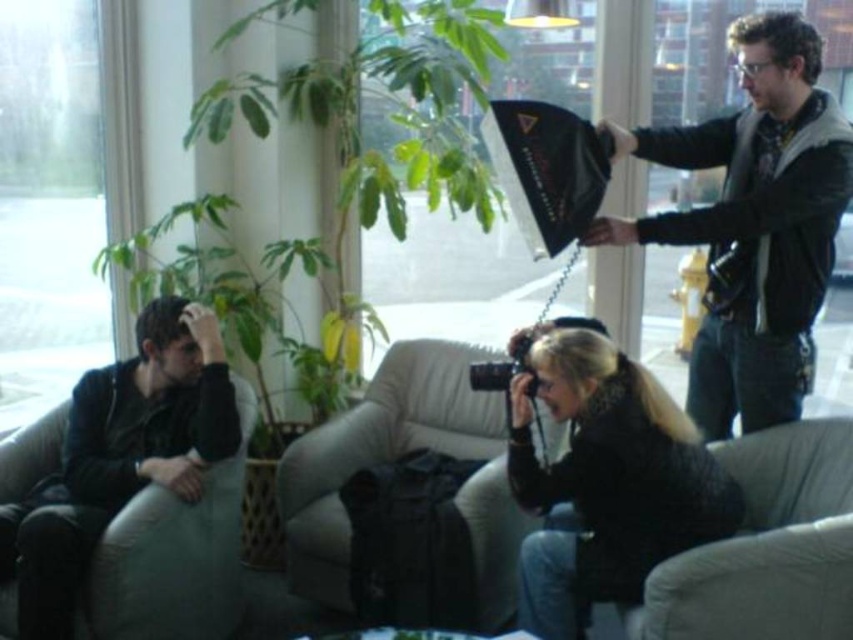
Is green leafy plant at center to the right of beige fabric couch at center from the viewer's perspective?

No, green leafy plant at center is not to the right of beige fabric couch at center.

Between green leafy plant at center and beige fabric couch at center, which one appears on the right side from the viewer's perspective?

From the viewer's perspective, beige fabric couch at center appears more on the right side.

Measure the distance between point (463, 145) and camera.

A distance of 3.37 meters exists between point (463, 145) and camera.

The width and height of the screenshot is (853, 640). What are the coordinates of `green leafy plant at center` in the screenshot? It's located at (337, 180).

Which is below, black leather jacket at left or gray fabric armchair at lower right?

gray fabric armchair at lower right is lower down.

Between point (175, 392) and point (764, 604), which one is positioned behind?

Point (175, 392)

Which is behind, point (41, 616) or point (672, 593)?

Point (41, 616)

This screenshot has height=640, width=853. Identify the location of black leather jacket at left. (120, 456).

Between point (822, 163) and point (160, 368), which one is positioned behind?

The point (160, 368) is behind.

Is black leather jacket at upper right wider than black leather jacket at left?

Correct, the width of black leather jacket at upper right exceeds that of black leather jacket at left.

Describe the element at coordinates (753, 225) in the screenshot. The image size is (853, 640). I see `black leather jacket at upper right` at that location.

This screenshot has width=853, height=640. I want to click on black leather jacket at upper right, so click(x=753, y=225).